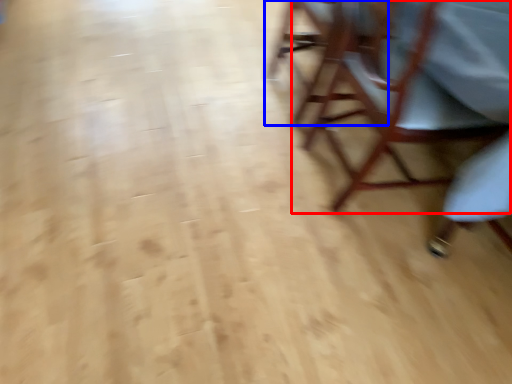
Question: Which object is closer to the camera taking this photo, chair (highlighted by a red box) or chair (highlighted by a blue box)?

Choices:
 (A) chair
 (B) chair

Answer: (A)